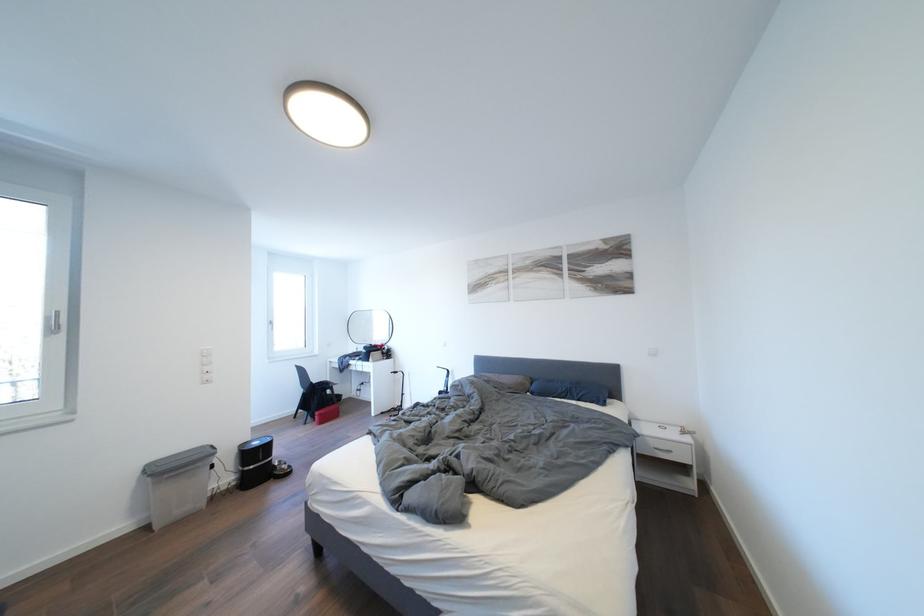
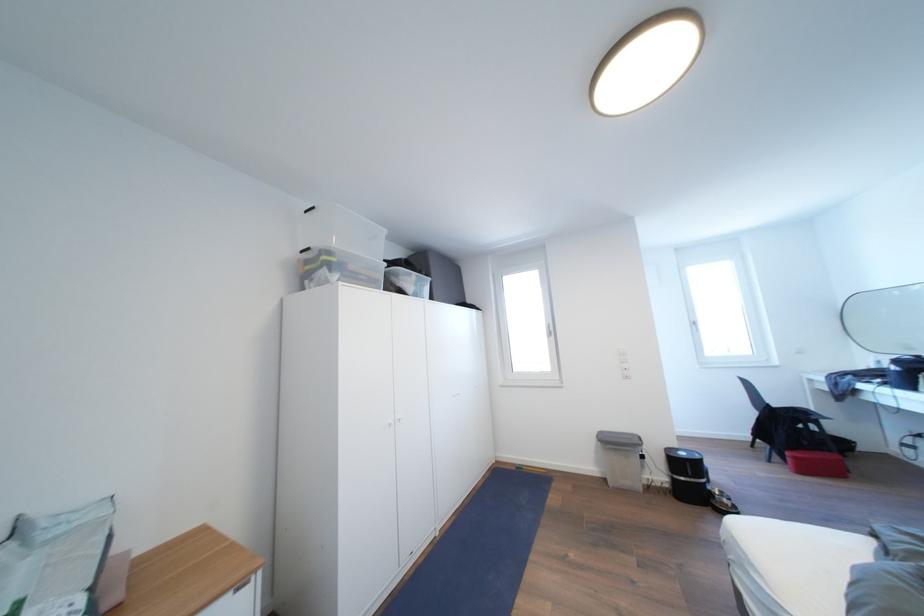
Find the pixel in the second image that matches (x=211, y=451) in the first image.

(639, 440)